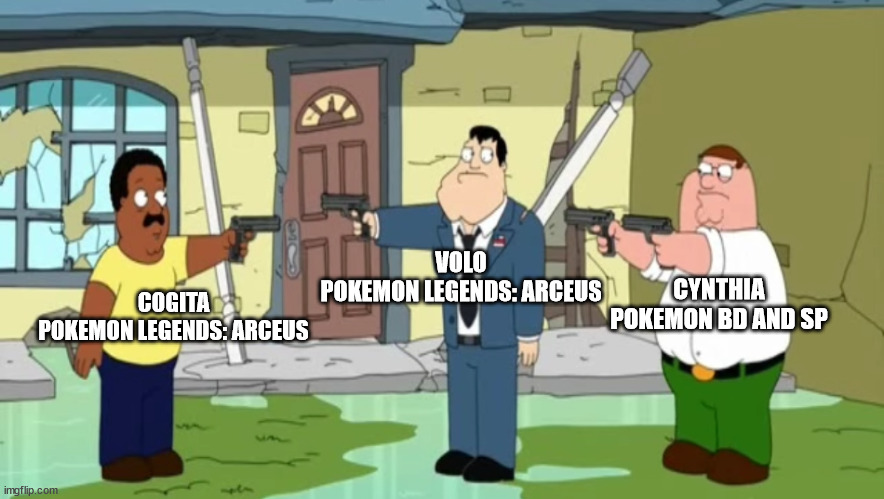
In order to click on door in this screenshot , I will do `click(324, 138)`.